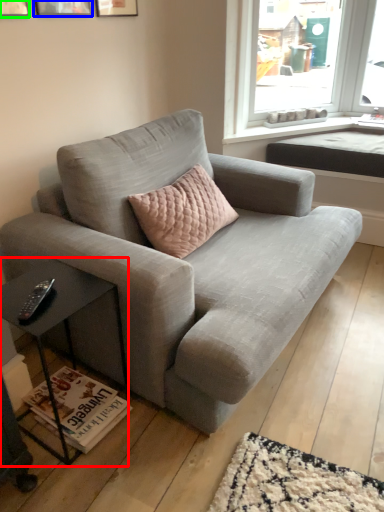
Question: Which object is positioned farthest from table (highlighted by a red box)? Select from picture frame (highlighted by a blue box) and picture frame (highlighted by a green box).

Choices:
 (A) picture frame
 (B) picture frame

Answer: (A)